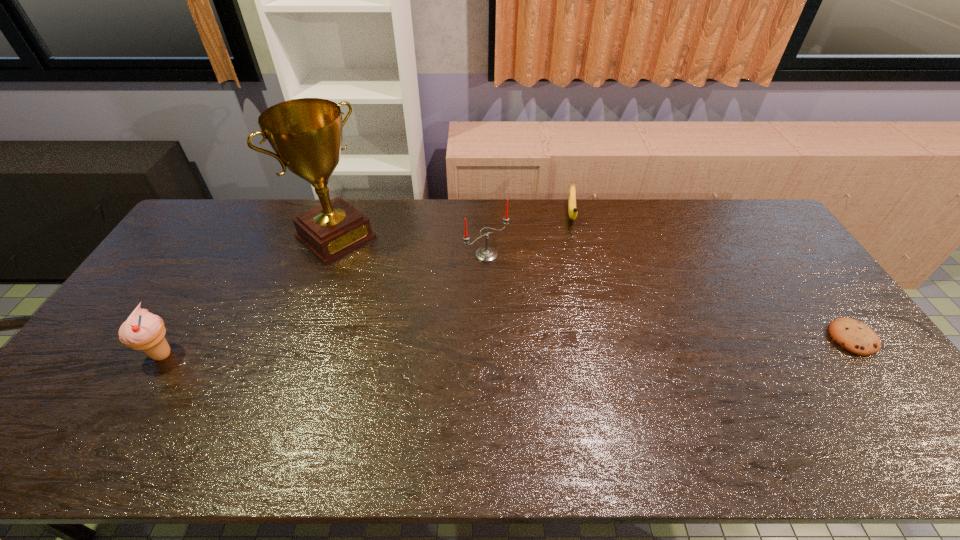
Where is `award present at the far edge`? Image resolution: width=960 pixels, height=540 pixels. award present at the far edge is located at coordinates (306, 134).

Where is `object at the left edge`? This screenshot has width=960, height=540. object at the left edge is located at coordinates (143, 330).

What are the coordinates of `object positioned at the right edge` in the screenshot? It's located at (854, 336).

Find the location of a particular element. This screenshot has height=540, width=960. free region at the far edge is located at coordinates (433, 206).

You are a GUI agent. You are given a task and a screenshot of the screen. Output one action in this format:
    pyautogui.click(x=<x>, y=<y>)
    Task: Click on the free space at the near edge
    
    Given the screenshot: What is the action you would take?
    pyautogui.click(x=463, y=387)

Image resolution: width=960 pixels, height=540 pixels. Find the location of `vacant space at the right edge of the desktop`. vacant space at the right edge of the desktop is located at coordinates (791, 320).

Where is `blank region between the tallest object and the shortest object`? Image resolution: width=960 pixels, height=540 pixels. blank region between the tallest object and the shortest object is located at coordinates (594, 288).

Identify the location of blank region between the candle and the shortest object. The width and height of the screenshot is (960, 540). (669, 296).

In order to click on unoccupied position between the tallest object and the rightmost object in this screenshot , I will do `click(594, 288)`.

Find the location of a particular element. This screenshot has height=540, width=960. vacant space that is in between the leftmost object and the banana is located at coordinates (367, 285).